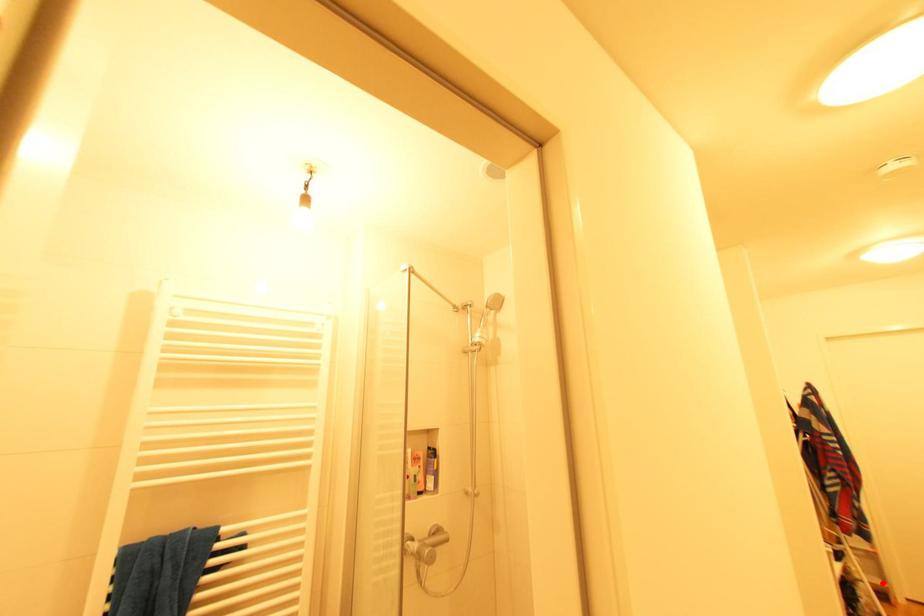
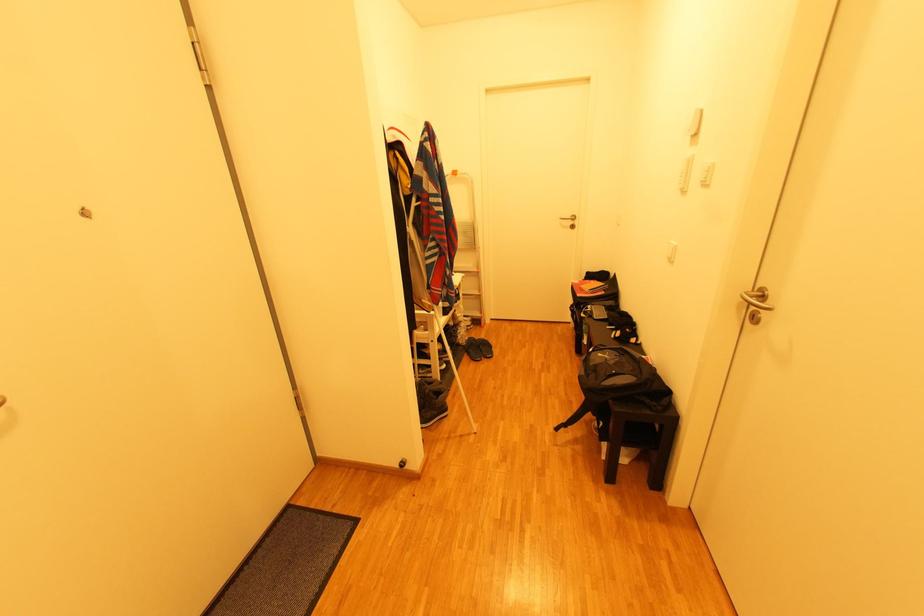
Where in the second image is the point corresponding to the highlighted location from the first image?

(481, 315)